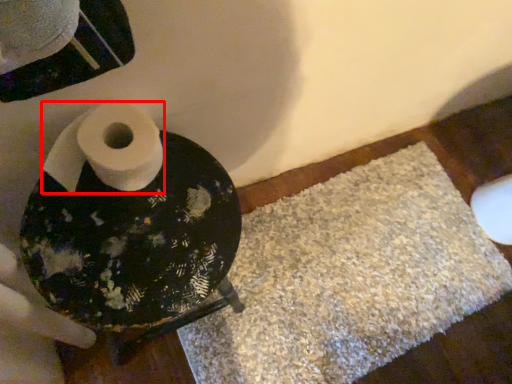
Question: Considering the relative positions of toilet paper (annotated by the red box) and bath mat in the image provided, where is toilet paper (annotated by the red box) located with respect to the staircase?

Choices:
 (A) right
 (B) left

Answer: (B)